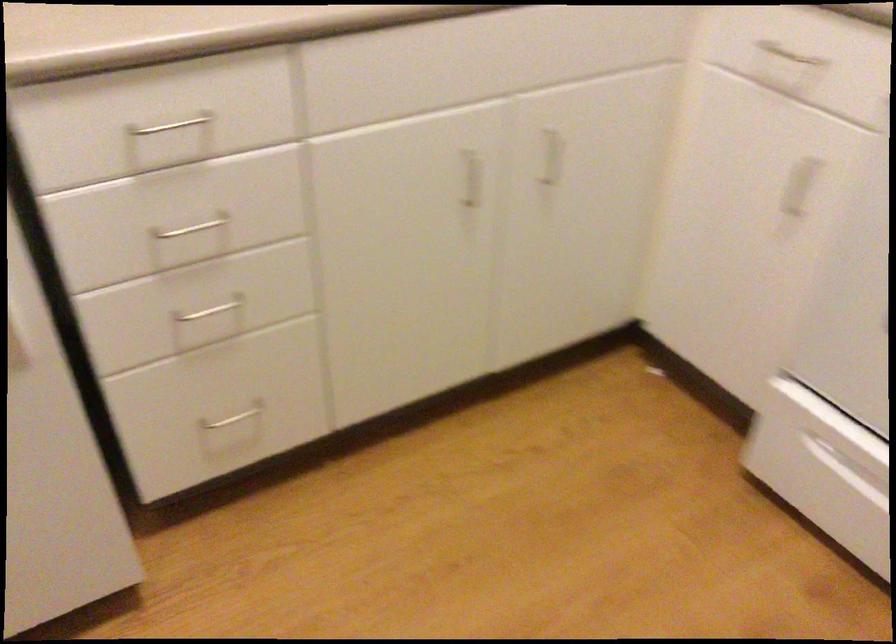
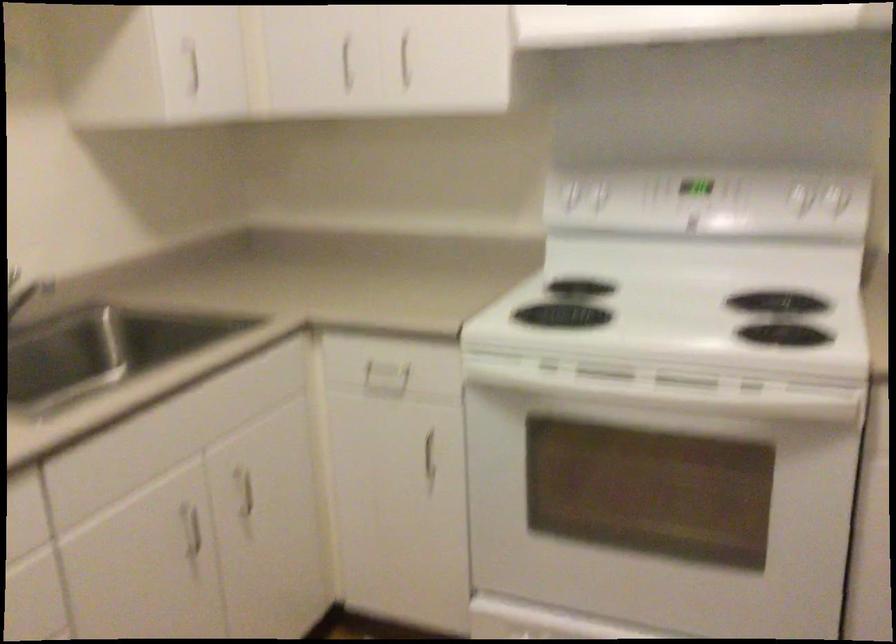
The images are taken continuously from a first-person perspective. In which direction is your viewpoint rotating?

The camera's rotation is toward right-up.